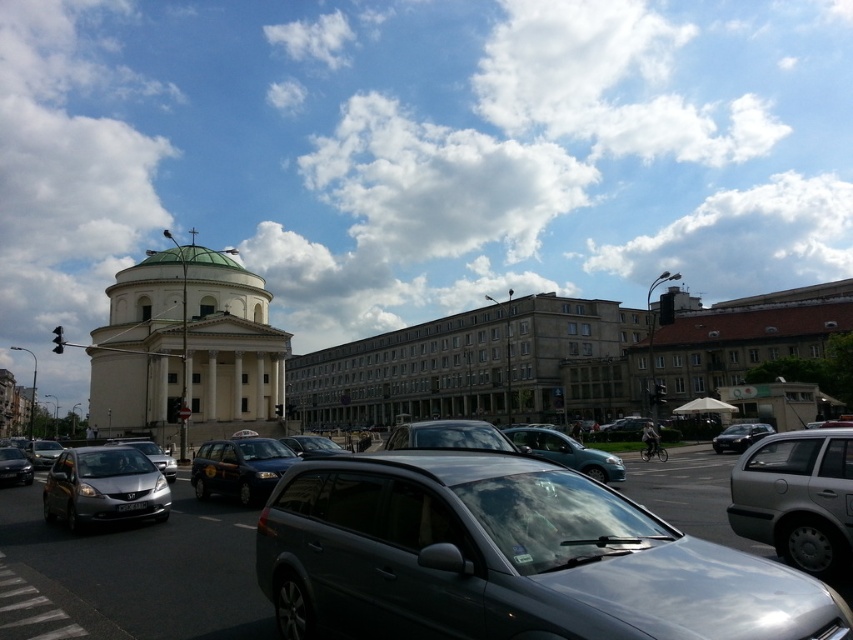
Does point (15, 452) come closer to viewer compared to point (144, 452)?

No.

At what (x,y) coordinates should I click in order to perform the action: click on shiny silver sedan at lower left. Please return your answer as a coordinate pair (x, y). The image size is (853, 640). Looking at the image, I should click on (15, 467).

Is silver metallic car at right positioned at the back of metallic silver car at center?

No, it is in front of metallic silver car at center.

Is silver metallic car at right above metallic silver car at center?

No, silver metallic car at right is not above metallic silver car at center.

Image resolution: width=853 pixels, height=640 pixels. In order to click on silver metallic car at right in this screenshot , I will do `click(798, 499)`.

The width and height of the screenshot is (853, 640). I want to click on silver metallic car at right, so (x=798, y=499).

Does point (572, 467) come behind point (753, 429)?

No, it is not.

Identify the location of metallic silver car at center. The height and width of the screenshot is (640, 853). (567, 452).